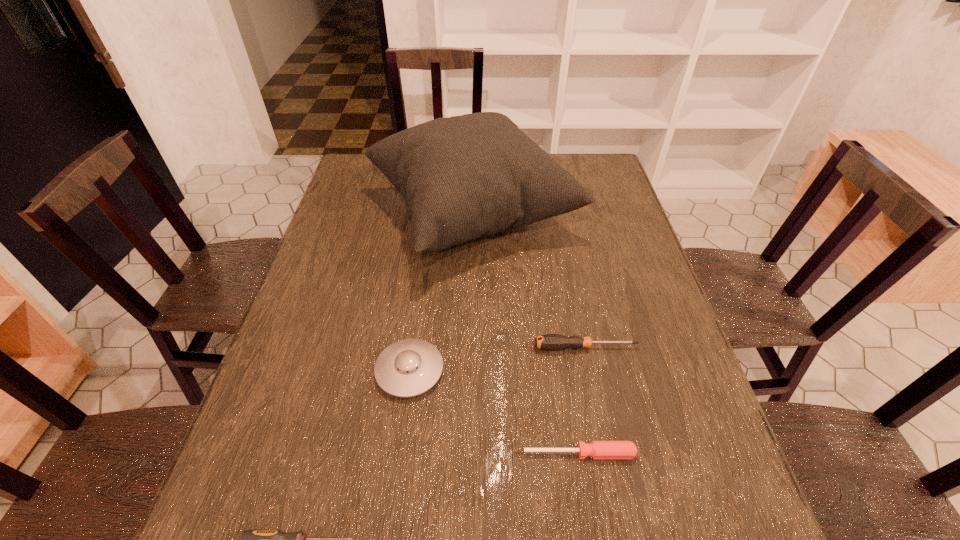
Identify the location of cushion. This screenshot has height=540, width=960. (463, 177).

You are a GUI agent. You are given a task and a screenshot of the screen. Output one action in this format:
    pyautogui.click(x=<x>, y=<y>)
    Task: Click on the farthest object
    The height and width of the screenshot is (540, 960).
    Given the screenshot: What is the action you would take?
    pyautogui.click(x=463, y=177)

At what (x,y) coordinates should I click in order to perform the action: click on the fourth shortest object. Please return your answer as a coordinate pair (x, y). This screenshot has height=540, width=960. Looking at the image, I should click on (407, 368).

Identify the location of the third tallest object. (552, 342).

This screenshot has width=960, height=540. I want to click on the farthest screwdriver, so click(x=552, y=342).

Where is `the second farthest screwdriver`? The width and height of the screenshot is (960, 540). the second farthest screwdriver is located at coordinates (596, 449).

Identify the location of vacant space located on the left of the cushion. (335, 214).

This screenshot has width=960, height=540. Find the location of `vacant region located on the back of the saucer`. vacant region located on the back of the saucer is located at coordinates coord(424,256).

Find the location of a particular element. The image size is (960, 540). blank space located 0.050m on the back of the farthest screwdriver is located at coordinates (581, 324).

At what (x,y) coordinates should I click in order to perform the action: click on vacant space located on the right of the second nearest screwdriver. Please return your answer as a coordinate pair (x, y). Looking at the image, I should click on 666,453.